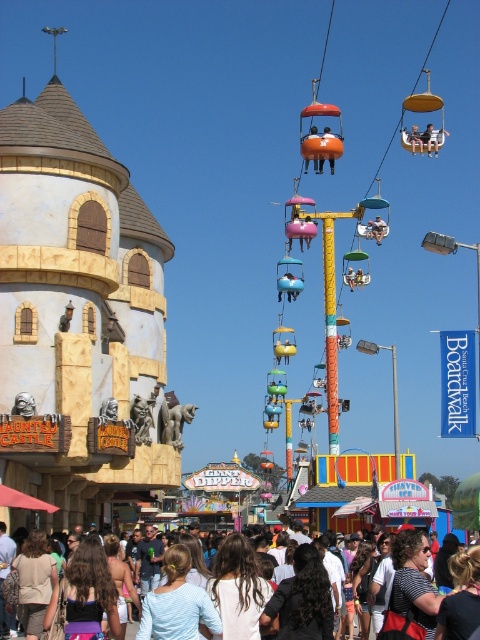
Question: Which of the following is the farthest from the observer?

Choices:
 (A) (386, 150)
 (B) (0, 364)
 (C) (204, 628)

Answer: (A)

Question: Which point is farther to the camera?

Choices:
 (A) orange plastic gondola at center
 (B) matte black hair at center

Answer: (A)

Question: Does matte black hair at center have a smaller size compared to orange plastic gondola at center?

Choices:
 (A) yes
 (B) no

Answer: (A)

Question: Can you confirm if beige stone tower at left is smaller than matte black hair at center?

Choices:
 (A) yes
 (B) no

Answer: (B)

Question: Which object is closer to the camera taking this photo?

Choices:
 (A) matte black hair at center
 (B) orange plastic gondola at center
 (C) beige stone tower at left

Answer: (A)

Question: Can you confirm if matte black hair at center is thinner than orange plastic gondola at center?

Choices:
 (A) yes
 (B) no

Answer: (B)